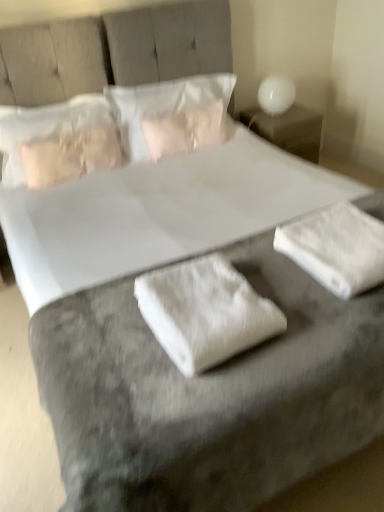
This screenshot has width=384, height=512. Identify the location of free space to the left of white fluffy towel at lower right, arranged as the second material when viewed from the left. (265, 267).